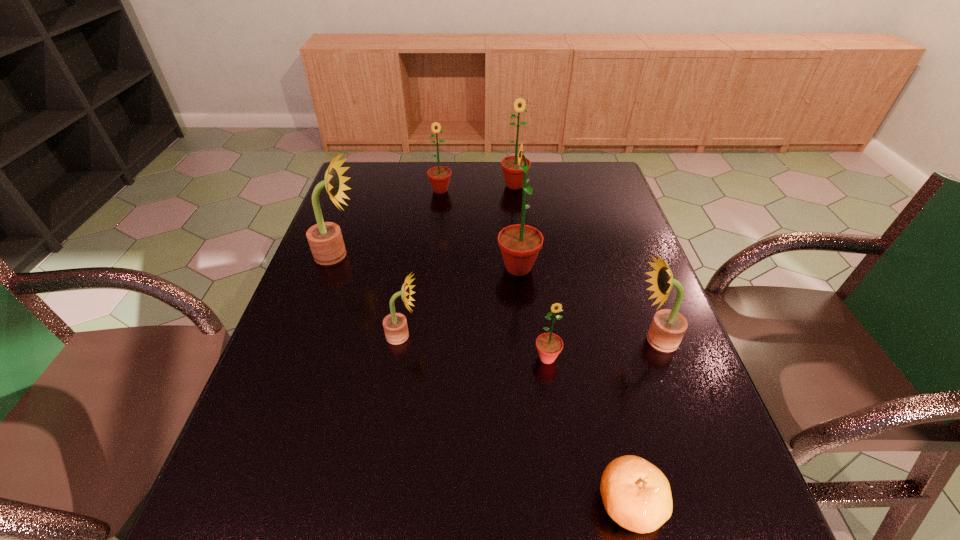
Locate an element on the screen. This screenshot has width=960, height=540. vacant space located on the face of the tallest object is located at coordinates (426, 267).

Where is `free region located on the face of the tallest object`? free region located on the face of the tallest object is located at coordinates (429, 267).

You are a GUI agent. You are given a task and a screenshot of the screen. Output one action in this format:
    pyautogui.click(x=<x>, y=<y>)
    Task: Click on the free spot located on the face of the tallest object
    The height and width of the screenshot is (540, 960).
    Given the screenshot: What is the action you would take?
    [355, 267]

The image size is (960, 540). What are the coordinates of `free space located 0.360m on the face of the farthest yellow sunflower` in the screenshot? It's located at (490, 255).

The height and width of the screenshot is (540, 960). Find the location of `free region located 0.370m on the face of the second biggest green sunflower`. free region located 0.370m on the face of the second biggest green sunflower is located at coordinates (523, 267).

I want to click on free space located 0.060m on the face of the rightmost yellow sunflower, so click(x=607, y=340).

Where is `vacant space positioned on the face of the rightmost yellow sunflower`? This screenshot has height=540, width=960. vacant space positioned on the face of the rightmost yellow sunflower is located at coordinates (572, 340).

Where is `free space located 0.120m on the face of the rightmost yellow sunflower`? free space located 0.120m on the face of the rightmost yellow sunflower is located at coordinates (581, 340).

I want to click on vacant space located 0.370m on the face of the leftmost green sunflower, so click(x=430, y=273).

The height and width of the screenshot is (540, 960). In order to click on vacant space located on the face of the smallest yellow sunflower in this screenshot , I will do `click(580, 335)`.